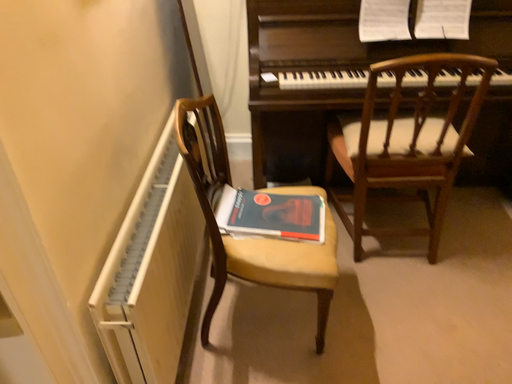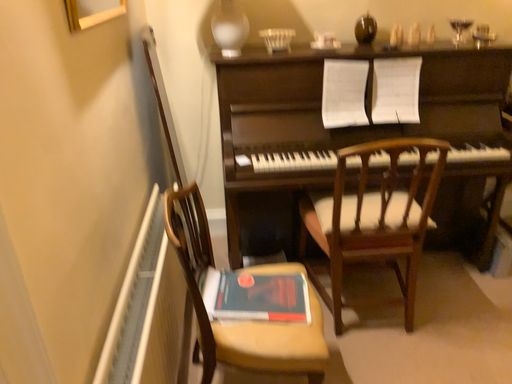
Question: Which way did the camera rotate in the video?

Choices:
 (A) rotated downward
 (B) rotated upward

Answer: (B)